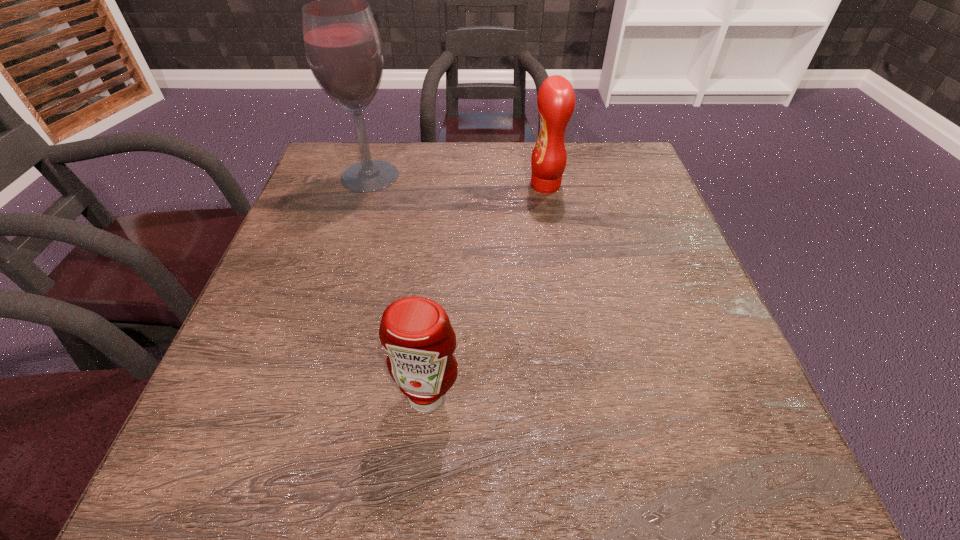
The height and width of the screenshot is (540, 960). What are the coordinates of `free space between the rightmost object and the shorter condiment` in the screenshot? It's located at (487, 291).

Where is `vacant area that lies between the right condiment and the alcohol`? The height and width of the screenshot is (540, 960). vacant area that lies between the right condiment and the alcohol is located at coordinates (458, 180).

I want to click on the second closest object to the alcohol, so click(x=416, y=332).

You are a GUI agent. You are given a task and a screenshot of the screen. Output one action in this format:
    pyautogui.click(x=<x>, y=<y>)
    Task: Click on the object that stands as the second closest to the leftmost object
    
    Given the screenshot: What is the action you would take?
    pyautogui.click(x=416, y=332)

Where is `free space that satisfies the following two spatial constraints: 1. on the label side of the farther condiment; 2. on the front side of the shorter condiment`? Image resolution: width=960 pixels, height=540 pixels. free space that satisfies the following two spatial constraints: 1. on the label side of the farther condiment; 2. on the front side of the shorter condiment is located at coordinates (584, 396).